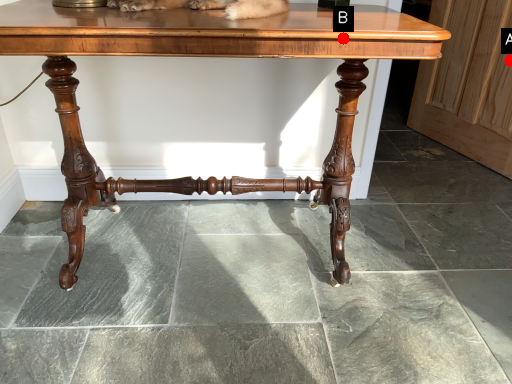
Question: Two points are circled on the image, labeled by A and B beside each circle. Which point appears farthest from the camera in this image?

Choices:
 (A) A is further
 (B) B is further

Answer: (A)